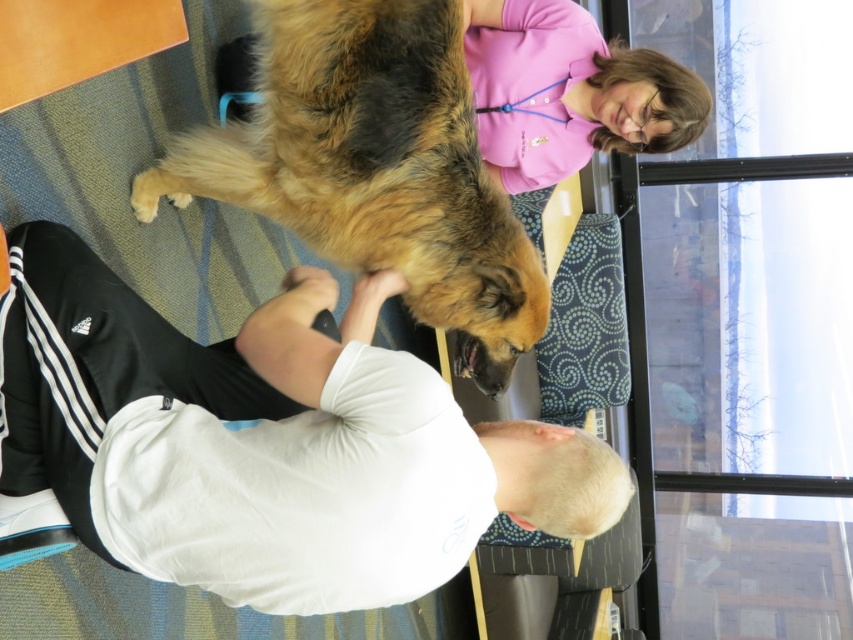
Between white cotton shirt at upper center and golden fur dog at center, which one appears on the right side from the viewer's perspective?

golden fur dog at center

At what (x,y) coordinates should I click in order to perform the action: click on white cotton shirt at upper center. Please return your answer as a coordinate pair (x, y). This screenshot has width=853, height=640. Looking at the image, I should click on click(x=264, y=442).

The height and width of the screenshot is (640, 853). Identify the location of white cotton shirt at upper center. click(264, 442).